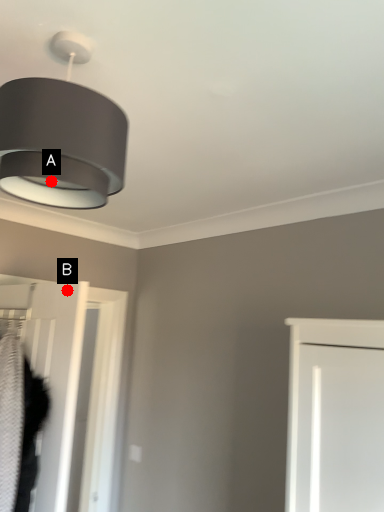
Question: Two points are circled on the image, labeled by A and B beside each circle. Which point is further to the camera?

Choices:
 (A) A is further
 (B) B is further

Answer: (B)